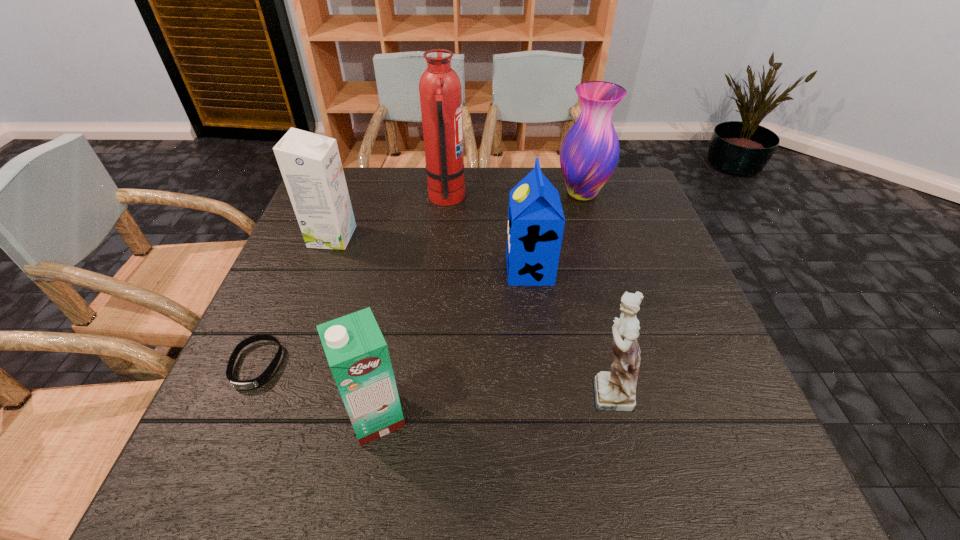
Locate an element on the screen. free region at the right edge of the desktop is located at coordinates (623, 249).

The height and width of the screenshot is (540, 960). In the image, there is a desktop. What are the coordinates of `vacant space at the far left corner` in the screenshot? It's located at (x=365, y=181).

Find the location of a particular element. The width and height of the screenshot is (960, 540). vacant position at the near left corner of the desktop is located at coordinates (283, 452).

At what (x,y) coordinates should I click in order to perform the action: click on blank space at the near right corner of the desktop. Please return your answer as a coordinate pair (x, y). The image size is (960, 540). Looking at the image, I should click on (733, 451).

This screenshot has height=540, width=960. Identify the location of vacant area between the vase and the nearest carton. (479, 305).

The height and width of the screenshot is (540, 960). In order to click on unoccupied position between the second carton from right to left and the figurine in this screenshot , I will do `click(491, 403)`.

You are a GUI agent. You are given a task and a screenshot of the screen. Output one action in this format:
    pyautogui.click(x=<x>, y=<y>)
    Task: Click on the free space between the rightmost carton and the nearest carton
    This screenshot has height=540, width=960.
    Given the screenshot: What is the action you would take?
    pyautogui.click(x=453, y=343)

I want to click on free spot between the fourth nearest object and the wristband, so click(x=393, y=318).

Where is `vacant area between the shortest object and the tallest object`? Image resolution: width=960 pixels, height=540 pixels. vacant area between the shortest object and the tallest object is located at coordinates (351, 281).

The width and height of the screenshot is (960, 540). In order to click on free point between the vase and the figurine in this screenshot , I will do `click(594, 292)`.